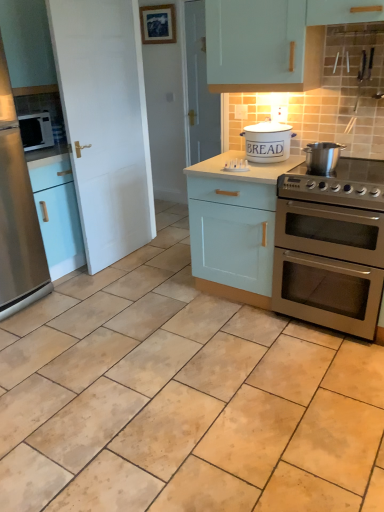
At what (x,y) coordinates should I click in order to perform the action: click on free space to the left of light blue wood cabinet at center. Please return your answer as a coordinate pair (x, y). Looking at the image, I should click on (162, 302).